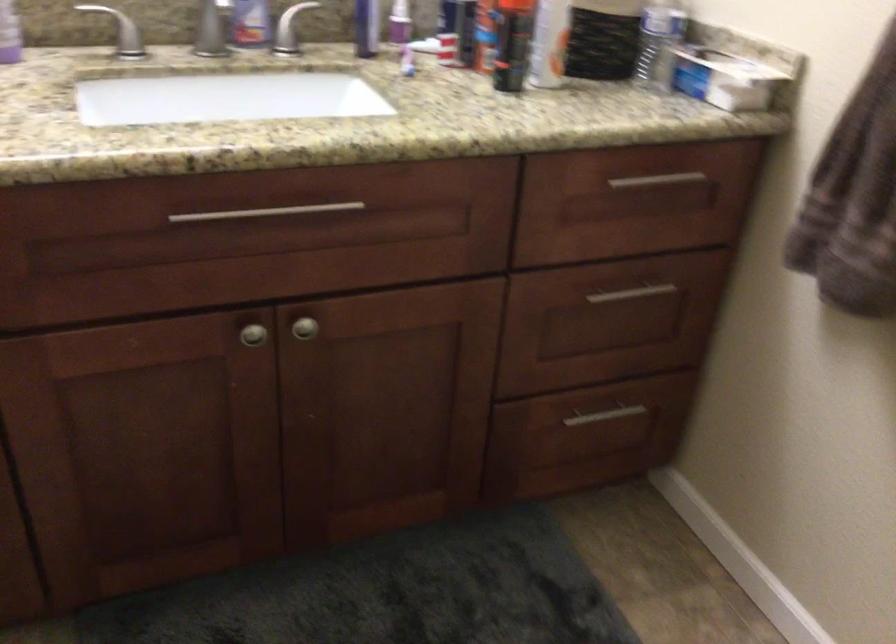
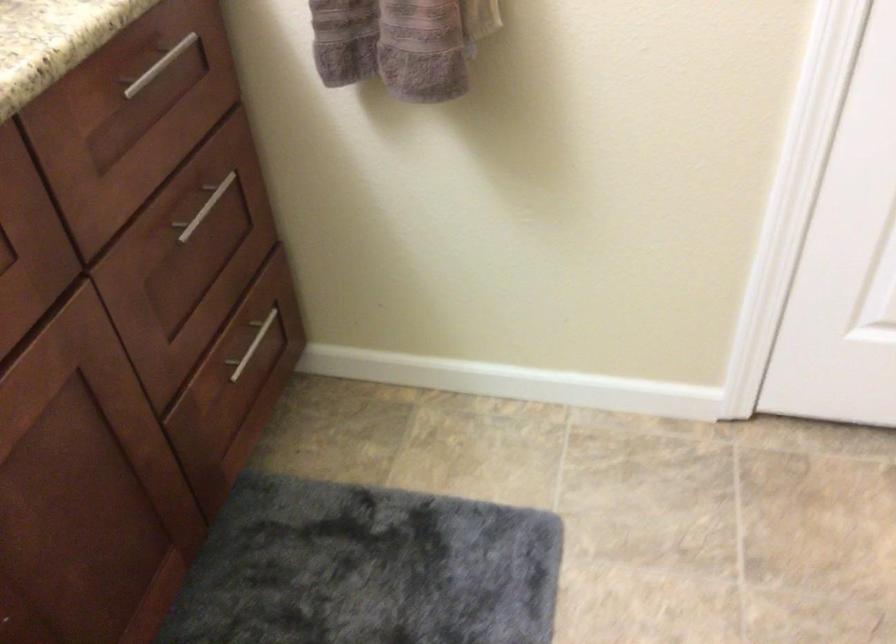
In the second image, find the point that corresponds to [600,413] in the first image.

(252, 345)